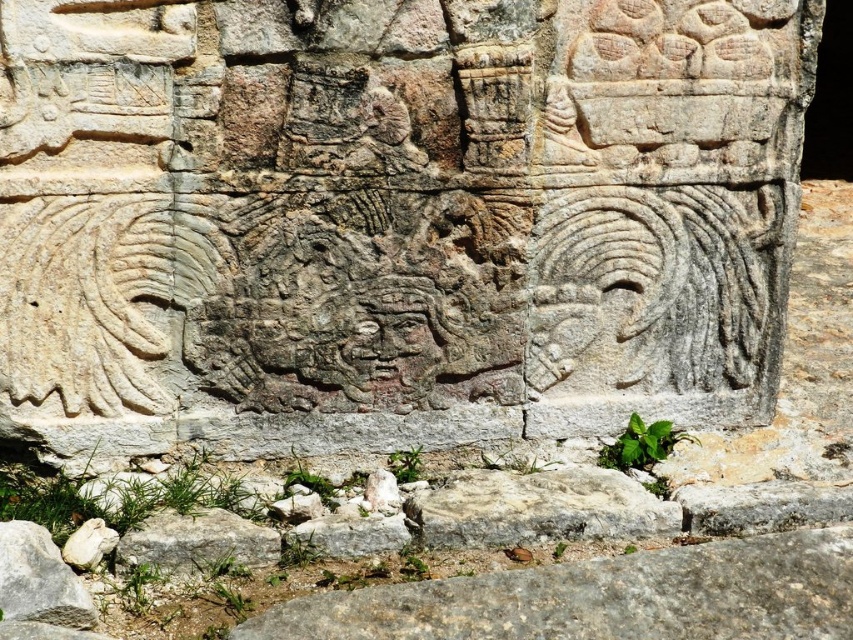
You are an archaeologist examining the ancient stone relief. You notice a specific point marked at coordinates (196, 541). What object is located at this point on the relief?

The white stone at lower center is located at point (196, 541).

You are an archaeologist examining the ancient stone relief. You notice two parts of the stone structure. The first is the gray stone carving at center, and the second is the gray rough stone at lower center. Based on their positions, which part is located higher up on the structure?

The gray stone carving at center is positioned over the gray rough stone at lower center, meaning it is higher up on the structure.